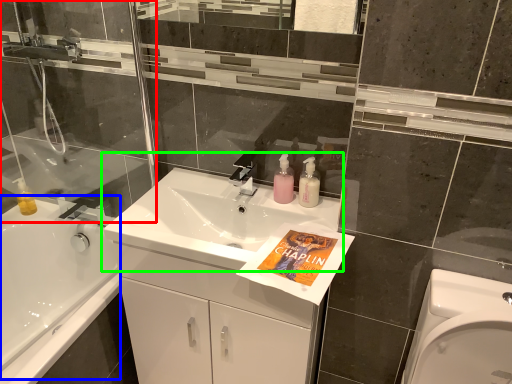
Question: Which object is positioned closest to shower door (highlighted by a red box)? Select from bath (highlighted by a blue box) and sink (highlighted by a green box).

Choices:
 (A) bath
 (B) sink

Answer: (A)